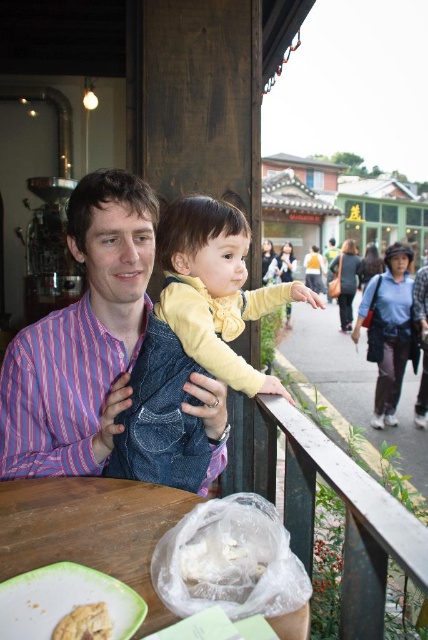
Question: Which point is farther to the camera?

Choices:
 (A) golden crumbly pastry at lower left
 (B) white plastic bag at lower center

Answer: (B)

Question: Where is white plastic bag at lower center located in relation to golden crumbly pastry at lower left in the image?

Choices:
 (A) below
 (B) above

Answer: (B)

Question: Where is denim vest at center located in relation to golden crumbly pastry at lower left in the image?

Choices:
 (A) above
 (B) below

Answer: (A)

Question: Among these objects, which one is nearest to the camera?

Choices:
 (A) golden crumbly pastry at lower left
 (B) white plastic bag at lower center

Answer: (A)

Question: Which of the following is the closest to the observer?

Choices:
 (A) wooden table at lower left
 (B) denim vest at center
 (C) golden crumbly pastry at lower left

Answer: (C)

Question: Where is denim vest at center located in relation to golden crumbly pastry at lower left in the image?

Choices:
 (A) right
 (B) left

Answer: (A)